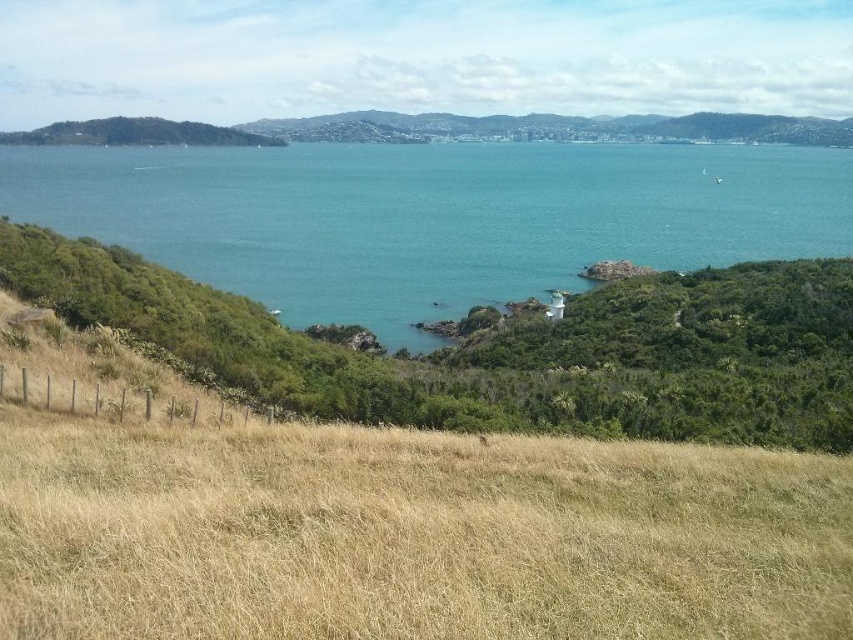
Question: Is blue water at center closer to the viewer compared to green grassy hillside at upper left?

Choices:
 (A) yes
 (B) no

Answer: (A)

Question: Where is blue water at center located in relation to green grassy hillside at upper left in the image?

Choices:
 (A) left
 (B) right

Answer: (B)

Question: Among these objects, which one is nearest to the camera?

Choices:
 (A) green grassy hillside at upper left
 (B) blue water at center

Answer: (B)

Question: Is blue water at center closer to camera compared to green grassy hillside at upper left?

Choices:
 (A) yes
 (B) no

Answer: (A)